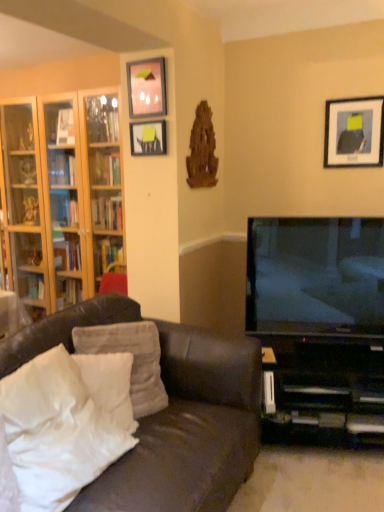
Where is `matte black picture frame at upper right, the 3th picture frame viewed from the left`? matte black picture frame at upper right, the 3th picture frame viewed from the left is located at coordinates (354, 132).

Measure the distance between matte glass picture frame at upper center, the 2th picture frame in the left-to-right sequence, and camera.

matte glass picture frame at upper center, the 2th picture frame in the left-to-right sequence, is 7.34 feet from camera.

Measure the distance between point (13,198) and camera.

Point (13,198) and camera are 3.47 meters apart from each other.

Measure the distance between white soft pillow at lower left, which is counted as the third pillow, starting from the front, and camera.

white soft pillow at lower left, which is counted as the third pillow, starting from the front, and camera are 5.96 feet apart from each other.

What are the coordinates of `matte black picture frame at upper right, the 3th picture frame viewed from the left` in the screenshot? It's located at (354, 132).

From a real-world perspective, is white soft pillow at lower left, arranged as the first pillow when viewed from the back, physically below wooden bookshelf at left?

Yes.

Can you confirm if white soft pillow at lower left, arranged as the first pillow when viewed from the back, is positioned to the left of wooden bookshelf at left?

No.

Is white soft pillow at lower left, which is counted as the third pillow, starting from the front, facing towards wooden bookshelf at left?

No, white soft pillow at lower left, which is counted as the third pillow, starting from the front, is not facing towards wooden bookshelf at left.

Would you say white soft pillow at lower left, which is counted as the third pillow, starting from the front, contains wooden bookshelf at left?

No, wooden bookshelf at left is not inside white soft pillow at lower left, which is counted as the third pillow, starting from the front.

Can you confirm if wooden bookshelf at left is bigger than matte glass picture frame at upper center, the second picture frame positioned from the right?

Correct, wooden bookshelf at left is larger in size than matte glass picture frame at upper center, the second picture frame positioned from the right.

Which is closer to the camera, (69, 258) or (166, 106)?

Point (69, 258) is positioned farther from the camera compared to point (166, 106).

Which is behind, wooden bookshelf at left or matte glass picture frame at upper center, the second picture frame positioned from the right?

wooden bookshelf at left is further away from the camera.

Is wooden bookshelf at left positioned with its back to matte glass picture frame at upper center, the 2th picture frame in the left-to-right sequence?

wooden bookshelf at left is not turned away from matte glass picture frame at upper center, the 2th picture frame in the left-to-right sequence.

Is white soft pillow at lower left, arranged as the 2th pillow when viewed from the front, not close to wooden bookshelf at left?

That's right, there is a large distance between white soft pillow at lower left, arranged as the 2th pillow when viewed from the front, and wooden bookshelf at left.

Find the location of a particular element. This screenshot has width=384, height=512. pillow that is the 2nd one when counting downward from the wooden bookshelf at left (from the image's perspective) is located at coordinates (110, 385).

Which object is thinner, white soft pillow at lower left, the second pillow when ordered from back to front, or wooden bookshelf at left?

With smaller width is white soft pillow at lower left, the second pillow when ordered from back to front.

Considering the sizes of objects white soft pillow at lower left, arranged as the 2th pillow when viewed from the front, and wooden bookshelf at left in the image provided, who is smaller, white soft pillow at lower left, arranged as the 2th pillow when viewed from the front, or wooden bookshelf at left?

white soft pillow at lower left, arranged as the 2th pillow when viewed from the front, is smaller.

From the brown leather couch at lower left, count 1st picture frame to the right and point to it. Please provide its 2D coordinates.

[(148, 138)]

Is brown leather couch at lower left placed right next to matte black picture frame at upper center, arranged as the third picture frame when viewed from the right?

No.

Is brown leather couch at lower left aimed at matte black picture frame at upper center, placed as the first picture frame when sorted from left to right?

No.

In the scene shown: Considering the sizes of objects brown leather couch at lower left and matte black picture frame at upper center, arranged as the third picture frame when viewed from the right, in the image provided, who is thinner, brown leather couch at lower left or matte black picture frame at upper center, arranged as the third picture frame when viewed from the right,?

Thinner between the two is matte black picture frame at upper center, arranged as the third picture frame when viewed from the right.

What's the angular difference between matte black picture frame at upper right, marked as the 1th picture frame in a right-to-left arrangement, and clear glass shelves at left's facing directions?

The angular difference between matte black picture frame at upper right, marked as the 1th picture frame in a right-to-left arrangement, and clear glass shelves at left is 0.185 degrees.

From the picture: Which is behind, matte black picture frame at upper right, marked as the 1th picture frame in a right-to-left arrangement, or clear glass shelves at left?

clear glass shelves at left.

From the picture: Who is smaller, matte black picture frame at upper right, marked as the 1th picture frame in a right-to-left arrangement, or clear glass shelves at left?

matte black picture frame at upper right, marked as the 1th picture frame in a right-to-left arrangement.

Is matte black picture frame at upper right, the 3th picture frame viewed from the left, wider than clear glass shelves at left?

In fact, matte black picture frame at upper right, the 3th picture frame viewed from the left, might be narrower than clear glass shelves at left.

From the picture: Looking at the image, does brown leather couch at lower left seem bigger or smaller compared to white soft pillow at lower left, arranged as the 2th pillow when viewed from the front?

Clearly, brown leather couch at lower left is larger in size than white soft pillow at lower left, arranged as the 2th pillow when viewed from the front.

Is brown leather couch at lower left wider or thinner than white soft pillow at lower left, arranged as the 2th pillow when viewed from the front?

Clearly, brown leather couch at lower left has more width compared to white soft pillow at lower left, arranged as the 2th pillow when viewed from the front.

Is brown leather couch at lower left to the right of white soft pillow at lower left, the second pillow when ordered from back to front, from the viewer's perspective?

No.

Is brown leather couch at lower left directly adjacent to white soft pillow at lower left, arranged as the 2th pillow when viewed from the front?

No, brown leather couch at lower left is not with white soft pillow at lower left, arranged as the 2th pillow when viewed from the front.

Is brown leather couch at lower left behind wooden bookshelf at left?

No, it is not.

Which object is positioned more to the right, brown leather couch at lower left or wooden bookshelf at left?

From the viewer's perspective, brown leather couch at lower left appears more on the right side.

How much distance is there between brown leather couch at lower left and wooden bookshelf at left?

brown leather couch at lower left is 4.85 feet away from wooden bookshelf at left.

Is brown leather couch at lower left oriented towards wooden bookshelf at left?

No, brown leather couch at lower left is not aimed at wooden bookshelf at left.

Where is `pillow that is the 1st object located in front of the wooden bookshelf at left`? pillow that is the 1st object located in front of the wooden bookshelf at left is located at coordinates (133, 359).

At what (x,y) coordinates should I click in order to perform the action: click on picture frame that is the 2nd one when counting rightward from the wooden bookshelf at left. Please return your answer as a coordinate pair (x, y). Looking at the image, I should click on (146, 88).

Considering their positions, is wooden bookshelf at left positioned closer to matte black picture frame at upper center, placed as the first picture frame when sorted from left to right, than matte glass picture frame at upper center, the second picture frame positioned from the right?

Among the two, matte glass picture frame at upper center, the second picture frame positioned from the right, is located nearer to matte black picture frame at upper center, placed as the first picture frame when sorted from left to right.

Considering their positions, is white soft pillow at lower left, arranged as the 2th pillow when viewed from the front, positioned further to clear glass shelves at left than brown leather couch at lower left?

white soft pillow at lower left, arranged as the 2th pillow when viewed from the front, is positioned further to the anchor clear glass shelves at left.

When comparing their distances from wooden bookshelf at left, does matte black picture frame at upper center, placed as the first picture frame when sorted from left to right, or white soft pillow at lower left, arranged as the 2th pillow when viewed from the front, seem closer?

matte black picture frame at upper center, placed as the first picture frame when sorted from left to right, is closer to wooden bookshelf at left.

Which object lies further to the anchor point clear glass shelves at left, matte black tv at right or matte black picture frame at upper right, the 3th picture frame viewed from the left?

Based on the image, matte black picture frame at upper right, the 3th picture frame viewed from the left, appears to be further to clear glass shelves at left.

Which object lies further to the anchor point matte black picture frame at upper right, the 3th picture frame viewed from the left, matte black tv at right or white soft pillow at lower left, positioned as the 3th pillow in back-to-front order?

Based on the image, white soft pillow at lower left, positioned as the 3th pillow in back-to-front order, appears to be further to matte black picture frame at upper right, the 3th picture frame viewed from the left.

Based on their spatial positions, is white soft pillow at lower left, positioned as the 3th pillow in back-to-front order, or brown leather couch at lower left further from wooden bookshelf at left?

Based on the image, white soft pillow at lower left, positioned as the 3th pillow in back-to-front order, appears to be further to wooden bookshelf at left.

When comparing their distances from clear glass shelves at left, does white soft pillow at lower left, the second pillow when ordered from back to front, or white soft pillow at lower left, the first pillow in the front-to-back sequence, seem further?

Based on the image, white soft pillow at lower left, the first pillow in the front-to-back sequence, appears to be further to clear glass shelves at left.

Considering their positions, is matte black picture frame at upper center, placed as the first picture frame when sorted from left to right, positioned further to white soft pillow at lower left, the first pillow in the front-to-back sequence, than wooden bookshelf at left?

wooden bookshelf at left is positioned further to the anchor white soft pillow at lower left, the first pillow in the front-to-back sequence.

Identify the location of television positioned between brown leather couch at lower left and matte black picture frame at upper right, marked as the 1th picture frame in a right-to-left arrangement, from near to far. This screenshot has height=512, width=384. (315, 275).

Find the location of a particular element. cabinetry between white soft pillow at lower left, arranged as the first pillow when viewed from the back, and clear glass shelves at left in the front-back direction is located at coordinates (61, 195).

This screenshot has width=384, height=512. Identify the location of picture frame between matte black picture frame at upper right, the 3th picture frame viewed from the left, and white soft pillow at lower left, arranged as the 2th pillow when viewed from the front, from top to bottom. (148, 138).

Where is `television between brown leather couch at lower left and clear glass shelves at left along the z-axis`? television between brown leather couch at lower left and clear glass shelves at left along the z-axis is located at coordinates (315, 275).